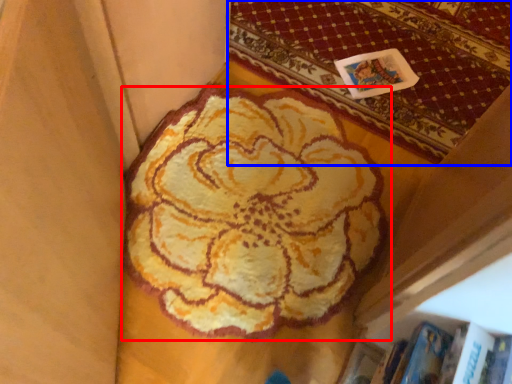
Question: Which object appears closest to the camera in this image, flower (highlighted by a red box) or mat (highlighted by a blue box)?

Choices:
 (A) flower
 (B) mat

Answer: (A)